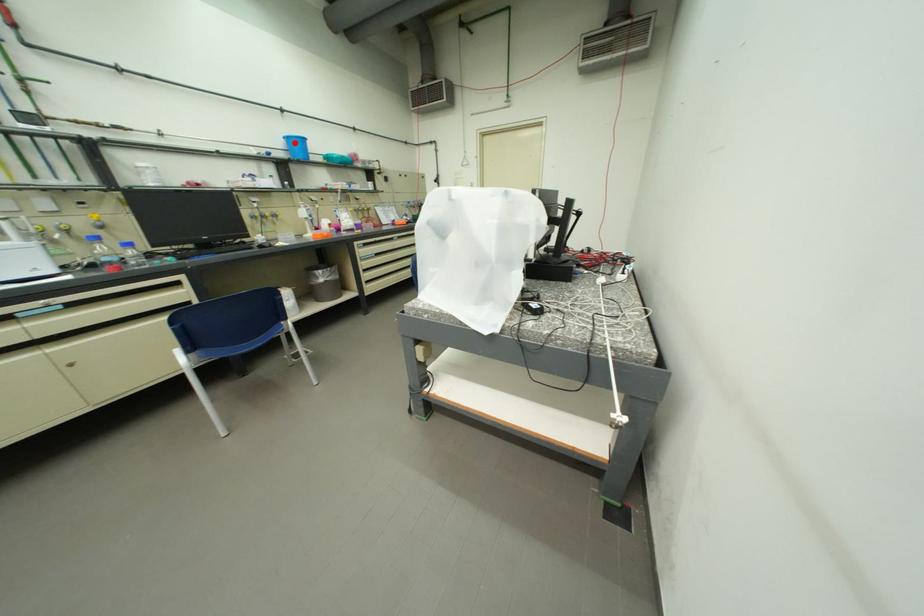
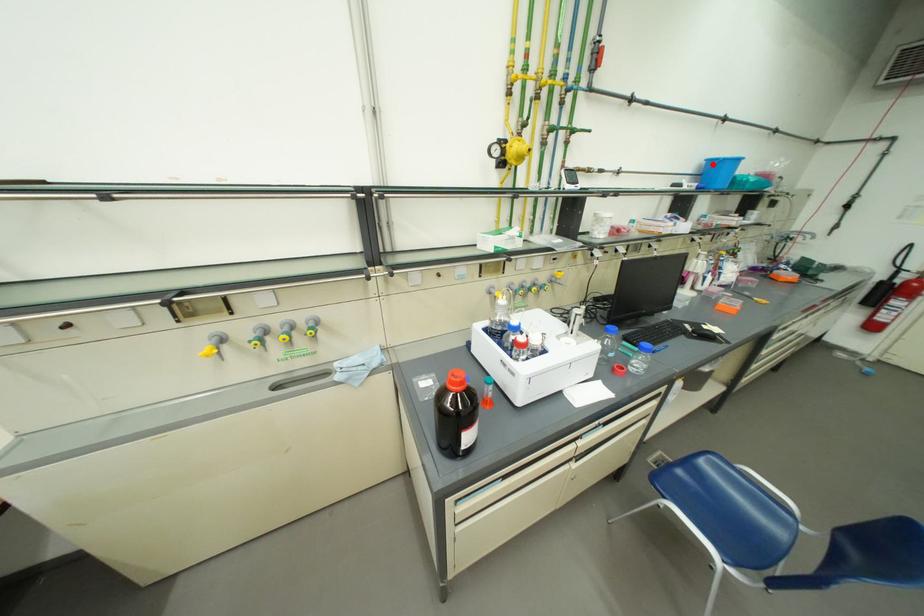
I am providing you with two images of the same scene from different viewpoints. A red point is marked on the first image and another point is marked on the second image. Is the red point in image1 aligned with the point shown in image2?

Yes